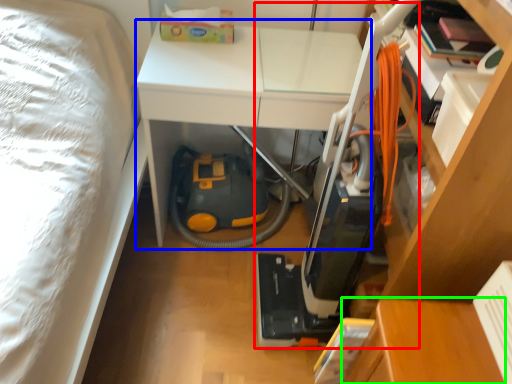
Question: Which is farther away from vacuum (highlighted by a red box)? table (highlighted by a blue box) or table (highlighted by a green box)?

Choices:
 (A) table
 (B) table

Answer: (A)